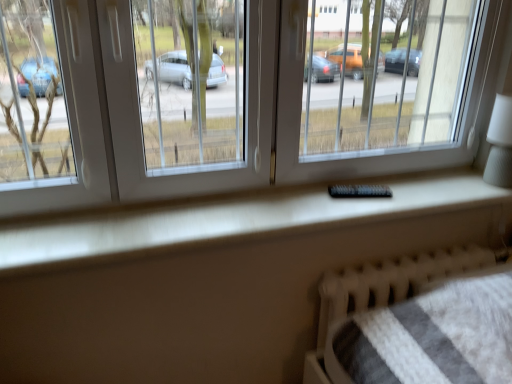
Question: Is transparent plastic window at center aimed at black plastic remote at center?

Choices:
 (A) yes
 (B) no

Answer: (B)

Question: Does transparent plastic window at center lie behind black plastic remote at center?

Choices:
 (A) yes
 (B) no

Answer: (B)

Question: Is transparent plastic window at center at the left side of black plastic remote at center?

Choices:
 (A) no
 (B) yes

Answer: (B)

Question: From a real-world perspective, is transparent plastic window at center located beneath black plastic remote at center?

Choices:
 (A) yes
 (B) no

Answer: (B)

Question: Does transparent plastic window at center have a greater width compared to black plastic remote at center?

Choices:
 (A) yes
 (B) no

Answer: (A)

Question: Is point (384, 74) positioned closer to the camera than point (391, 190)?

Choices:
 (A) closer
 (B) farther

Answer: (B)

Question: Choose the correct answer: Is transparent plastic window at center inside black plastic remote at center or outside it?

Choices:
 (A) inside
 (B) outside

Answer: (B)

Question: In terms of height, does transparent plastic window at center look taller or shorter compared to black plastic remote at center?

Choices:
 (A) tall
 (B) short

Answer: (A)

Question: Considering the positions of transparent plastic window at center and black plastic remote at center in the image, is transparent plastic window at center wider or thinner than black plastic remote at center?

Choices:
 (A) thin
 (B) wide

Answer: (B)

Question: Considering the positions of white textured lampshade at right and black plastic remote at center in the image, is white textured lampshade at right wider or thinner than black plastic remote at center?

Choices:
 (A) thin
 (B) wide

Answer: (B)

Question: Based on their positions, is white textured lampshade at right located to the left or right of black plastic remote at center?

Choices:
 (A) right
 (B) left

Answer: (A)

Question: Considering the positions of point 510,109 and point 348,188, is point 510,109 closer or farther from the camera than point 348,188?

Choices:
 (A) farther
 (B) closer

Answer: (B)

Question: From a real-world perspective, relative to black plastic remote at center, is white textured lampshade at right vertically above or below?

Choices:
 (A) below
 (B) above

Answer: (B)

Question: In the image, is black plastic remote at center on the left side or the right side of white knitted hospital bed at lower right?

Choices:
 (A) right
 (B) left

Answer: (B)

Question: In terms of size, does black plastic remote at center appear bigger or smaller than white knitted hospital bed at lower right?

Choices:
 (A) small
 (B) big

Answer: (A)